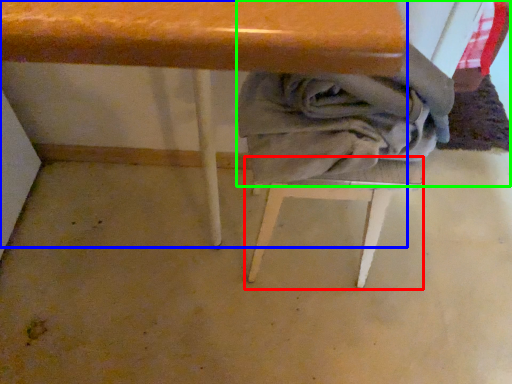
Question: Based on their relative distances, which object is nearer to step stool (highlighted by a red box)? Choose from table (highlighted by a blue box) and laundry (highlighted by a green box).

Choices:
 (A) table
 (B) laundry

Answer: (B)